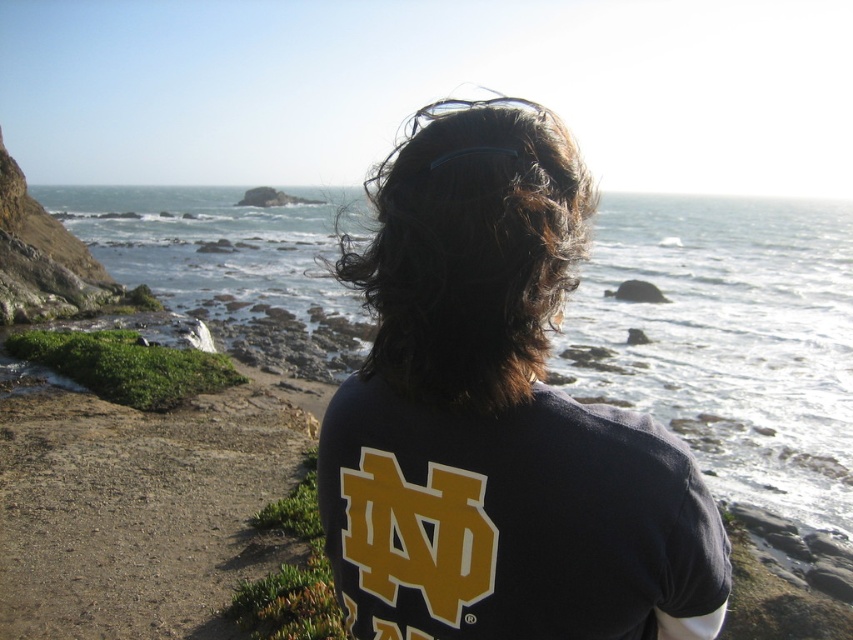
You are a photographer aiming to capture the clear water at center and the dark brown curly hair at center in the same frame. Which object should you focus on first to ensure both are in the frame?

The clear water at center has a larger size compared to dark brown curly hair at center, so you should focus on the clear water at center first to ensure both are in the frame.

You are a photographer trying to capture the scene from behind the person. You notice the clear water at center and the dark blue jersey at center. Which object is positioned higher in the image?

The clear water at center is above the dark blue jersey at center.